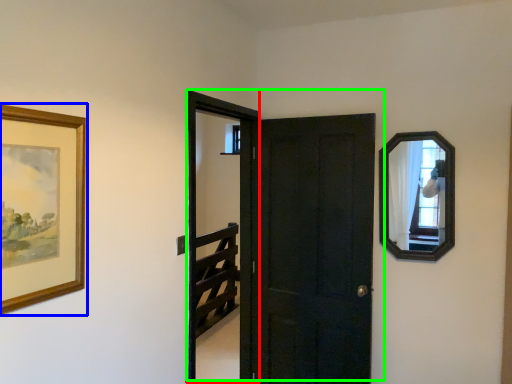
Question: Which is farther away from screen door (highlighted by a red box)? picture frame (highlighted by a blue box) or door (highlighted by a green box)?

Choices:
 (A) picture frame
 (B) door

Answer: (A)